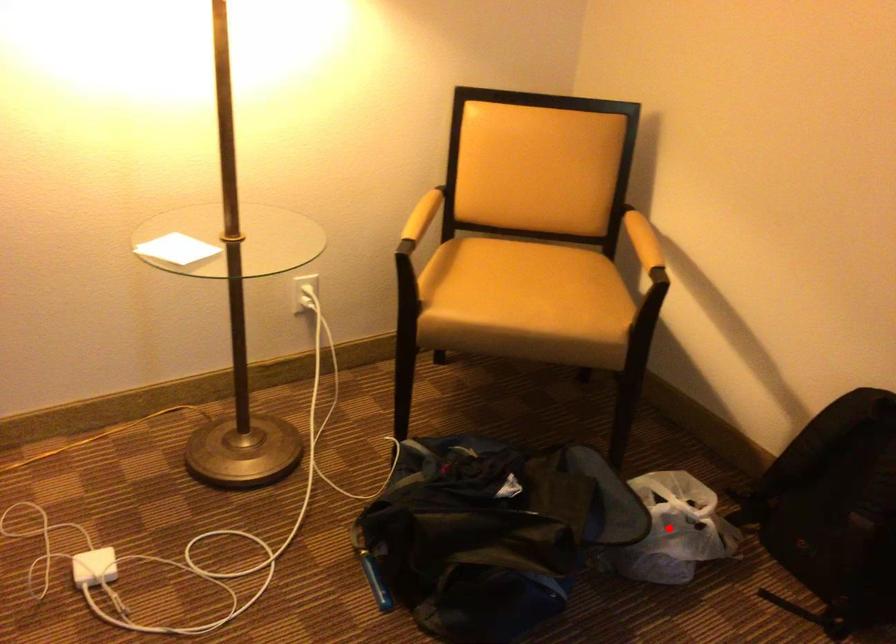
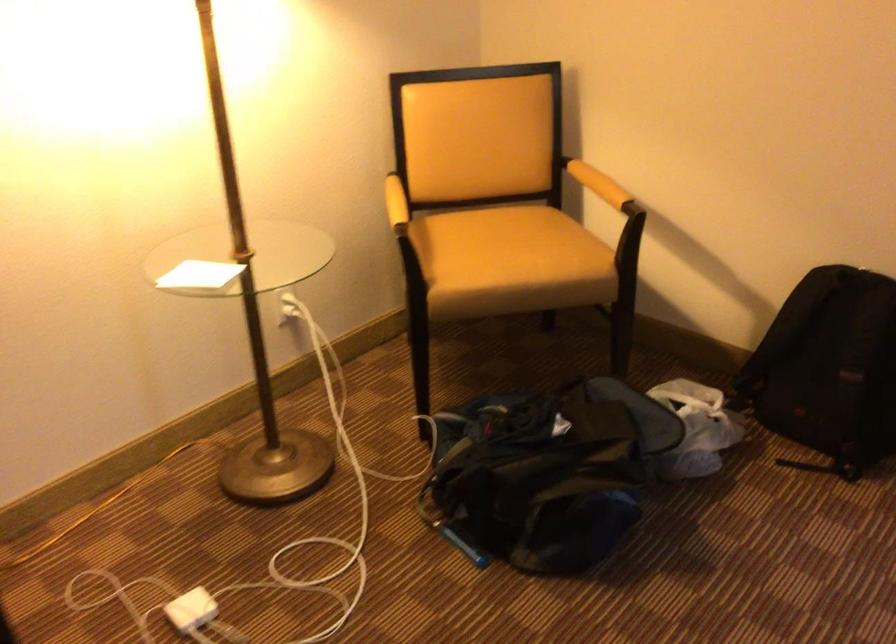
Locate, in the second image, the point that corresponds to the highlighted location in the first image.

(696, 428)